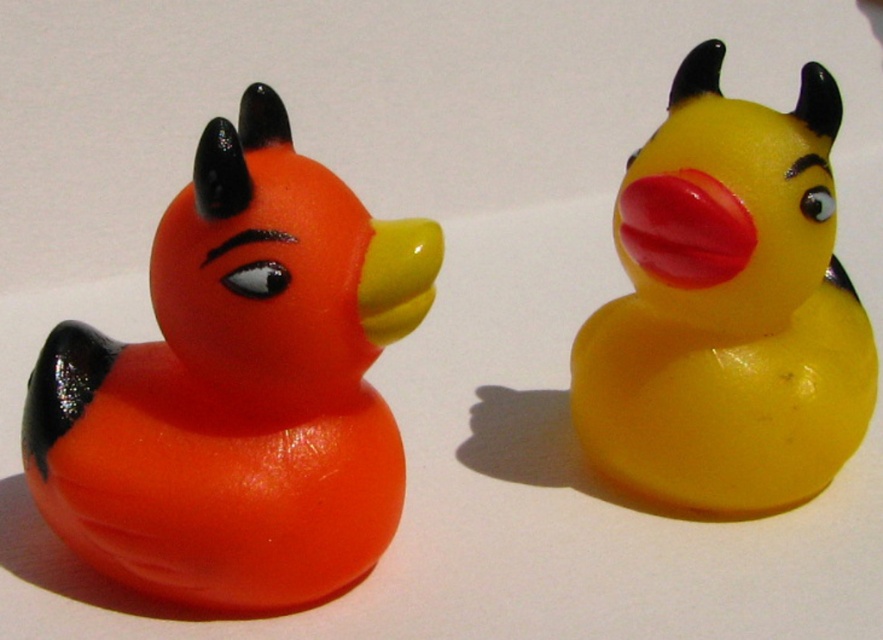
Can you confirm if matte orange rubber duck at left is positioned to the right of yellow rubber duck at center?

In fact, matte orange rubber duck at left is to the left of yellow rubber duck at center.

Is matte orange rubber duck at left positioned in front of yellow rubber duck at center?

Yes, it is in front of yellow rubber duck at center.

Find the location of a particular element. matte orange rubber duck at left is located at coordinates click(x=238, y=387).

Which of these two, yellow rubber duck at center or rubber at right, stands shorter?

rubber at right

This screenshot has width=883, height=640. I want to click on yellow rubber duck at center, so click(x=727, y=307).

Between matte orange rubber duck at left and rubber at right, which one has more height?

With more height is matte orange rubber duck at left.

Does matte orange rubber duck at left have a greater width compared to rubber at right?

Correct, the width of matte orange rubber duck at left exceeds that of rubber at right.

Between point (208, 342) and point (746, 248), which one is positioned in front?

Point (208, 342) is in front.

The width and height of the screenshot is (883, 640). In order to click on matte orange rubber duck at left in this screenshot , I will do `click(238, 387)`.